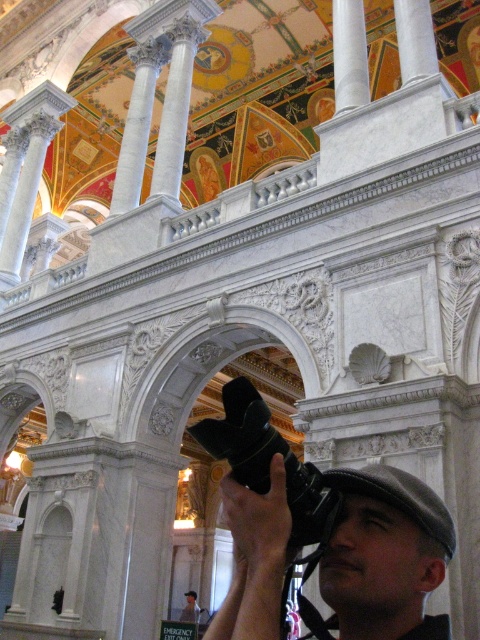
Question: Which point is closer to the camera?

Choices:
 (A) (356, 61)
 (B) (321, 536)
 (C) (415, 586)

Answer: (C)

Question: Among these points, which one is farthest from the camera?

Choices:
 (A) (220, 449)
 (B) (282, 477)
 (C) (343, 72)

Answer: (C)

Question: Among these objects, which one is nearest to the camera?

Choices:
 (A) black matte video camera at center
 (B) white marble pillar at upper center
 (C) black matte camera at center

Answer: (C)

Question: Is black matte camera at center wider than black matte video camera at center?

Choices:
 (A) no
 (B) yes

Answer: (A)

Question: Is black matte video camera at center closer to camera compared to white marble pillar at upper center?

Choices:
 (A) yes
 (B) no

Answer: (A)

Question: Where is black matte video camera at center located in relation to white marble pillar at upper center in the image?

Choices:
 (A) left
 (B) right

Answer: (A)